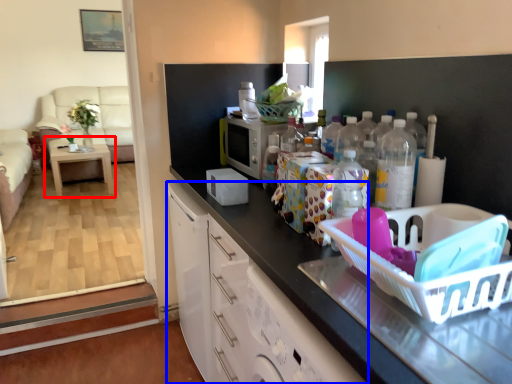
Question: Which point is closer to the camera, table (highlighted by a red box) or cabinetry (highlighted by a blue box)?

Choices:
 (A) table
 (B) cabinetry

Answer: (B)